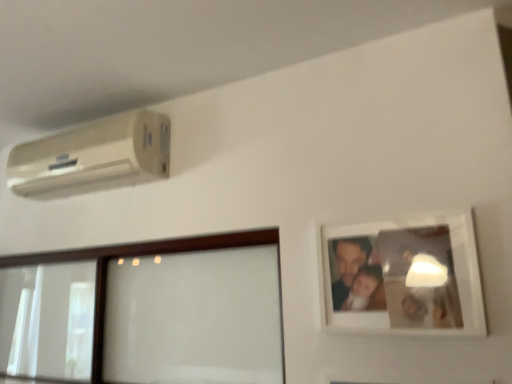
Question: Does point click(134, 167) appear closer or farther from the camera than point click(421, 306)?

Choices:
 (A) farther
 (B) closer

Answer: (A)

Question: From a real-world perspective, is white textured air conditioner at upper left positioned above or below white matte picture frame at upper right?

Choices:
 (A) above
 (B) below

Answer: (A)

Question: In terms of size, does white textured air conditioner at upper left appear bigger or smaller than white matte picture frame at upper right?

Choices:
 (A) big
 (B) small

Answer: (A)

Question: Does point (458, 302) appear closer or farther from the camera than point (89, 182)?

Choices:
 (A) farther
 (B) closer

Answer: (B)

Question: Is white matte picture frame at upper right inside the boundaries of white textured air conditioner at upper left, or outside?

Choices:
 (A) inside
 (B) outside

Answer: (B)

Question: Visually, is white matte picture frame at upper right positioned to the left or to the right of white textured air conditioner at upper left?

Choices:
 (A) left
 (B) right

Answer: (B)

Question: Is white matte picture frame at upper right wider or thinner than white textured air conditioner at upper left?

Choices:
 (A) thin
 (B) wide

Answer: (A)